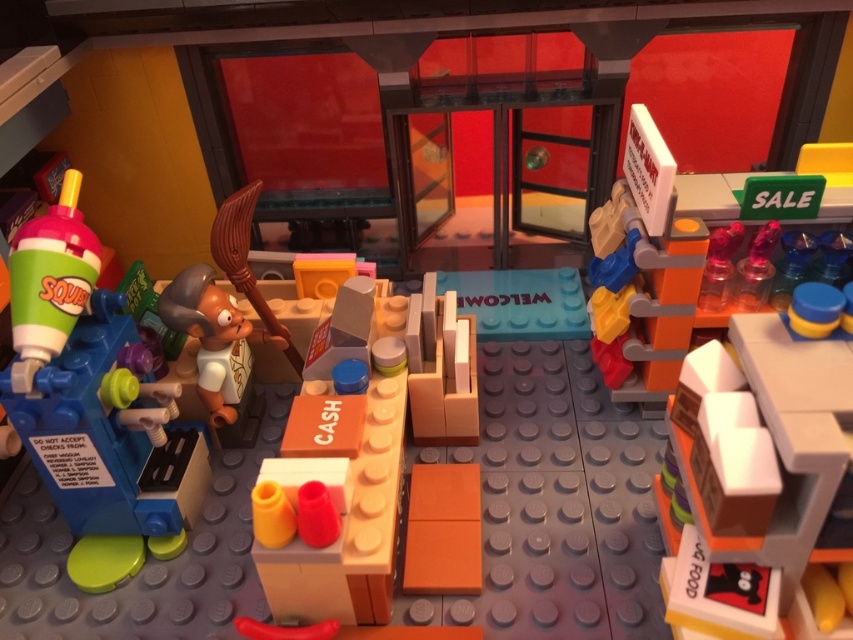
Question: Which object appears closest to the camera in this image?

Choices:
 (A) matte plastic soda machine at left
 (B) orange matte cash register at center
 (C) smooth white shelf at right

Answer: (C)

Question: Which of the following is the closest to the observer?

Choices:
 (A) (844, 342)
 (B) (82, 268)
 (C) (286, 444)

Answer: (A)

Question: Is smooth white shelf at right positioned at the back of orange matte cash register at center?

Choices:
 (A) yes
 (B) no

Answer: (B)

Question: Which point is farther to the camera?

Choices:
 (A) smooth brown figure at center-left
 (B) orange matte cash register at center

Answer: (A)

Question: Is smooth white shelf at right above smooth brown figure at center-left?

Choices:
 (A) no
 (B) yes

Answer: (A)

Question: Can you confirm if smooth white shelf at right is thinner than smooth brown figure at center-left?

Choices:
 (A) yes
 (B) no

Answer: (B)